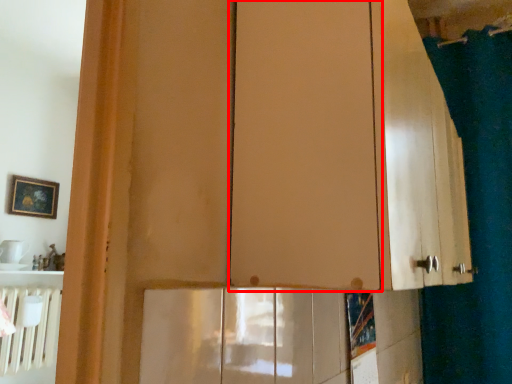
Question: Observing the image, what is the correct spatial positioning of screen door (annotated by the red box) in reference to shower curtain?

Choices:
 (A) right
 (B) left

Answer: (B)